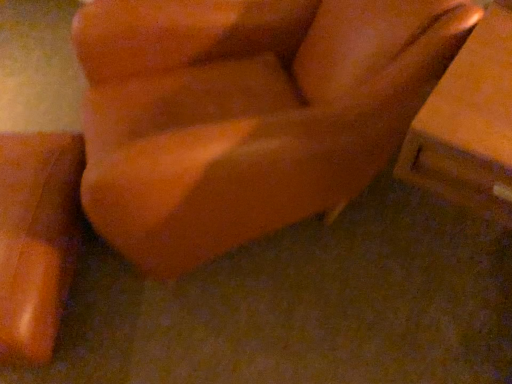
This screenshot has width=512, height=384. Identify the location of matte orange vase at lower left, which ranks as the second furniture in right-to-left order. (37, 238).

What is the approximate width of matte orange vase at lower left, which ranks as the second furniture in right-to-left order?

matte orange vase at lower left, which ranks as the second furniture in right-to-left order, is 18.40 inches in width.

The width and height of the screenshot is (512, 384). What do you see at coordinates (37, 238) in the screenshot?
I see `matte orange vase at lower left, which ranks as the second furniture in right-to-left order` at bounding box center [37, 238].

This screenshot has width=512, height=384. Describe the element at coordinates (246, 113) in the screenshot. I see `matte orange chair at center, marked as the first furniture in a right-to-left arrangement` at that location.

What is the approximate height of matte orange chair at center, marked as the first furniture in a right-to-left arrangement?

matte orange chair at center, marked as the first furniture in a right-to-left arrangement, is 30.83 inches in height.

I want to click on matte orange chair at center, marked as the first furniture in a right-to-left arrangement, so click(x=246, y=113).

At what (x,y) coordinates should I click in order to perform the action: click on matte orange vase at lower left, the first furniture in the left-to-right sequence. Please return your answer as a coordinate pair (x, y). Looking at the image, I should click on (37, 238).

Which object is positioned more to the left, matte orange chair at center, marked as the first furniture in a right-to-left arrangement, or matte orange vase at lower left, the first furniture in the left-to-right sequence?

From the viewer's perspective, matte orange vase at lower left, the first furniture in the left-to-right sequence, appears more on the left side.

Which is in front, matte orange chair at center, acting as the 2th furniture starting from the left, or matte orange vase at lower left, which ranks as the second furniture in right-to-left order?

matte orange chair at center, acting as the 2th furniture starting from the left, is in front.

Does point (198, 36) appear closer or farther from the camera than point (58, 210)?

Clearly, point (198, 36) is more distant from the camera than point (58, 210).

From the image's perspective, is matte orange chair at center, acting as the 2th furniture starting from the left, beneath matte orange vase at lower left, the first furniture in the left-to-right sequence?

No, from the image's perspective, matte orange chair at center, acting as the 2th furniture starting from the left, is not below matte orange vase at lower left, the first furniture in the left-to-right sequence.

From a real-world perspective, is matte orange chair at center, marked as the first furniture in a right-to-left arrangement, physically located above or below matte orange vase at lower left, which ranks as the second furniture in right-to-left order?

matte orange chair at center, marked as the first furniture in a right-to-left arrangement, is above matte orange vase at lower left, which ranks as the second furniture in right-to-left order.

Considering the relative sizes of matte orange chair at center, acting as the 2th furniture starting from the left, and matte orange vase at lower left, the first furniture in the left-to-right sequence, in the image provided, is matte orange chair at center, acting as the 2th furniture starting from the left, thinner than matte orange vase at lower left, the first furniture in the left-to-right sequence,?

In fact, matte orange chair at center, acting as the 2th furniture starting from the left, might be wider than matte orange vase at lower left, the first furniture in the left-to-right sequence.

Which of these two, matte orange chair at center, marked as the first furniture in a right-to-left arrangement, or matte orange vase at lower left, which ranks as the second furniture in right-to-left order, stands shorter?

matte orange vase at lower left, which ranks as the second furniture in right-to-left order.

Between matte orange chair at center, acting as the 2th furniture starting from the left, and matte orange vase at lower left, which ranks as the second furniture in right-to-left order, which one has larger size?

Bigger between the two is matte orange chair at center, acting as the 2th furniture starting from the left.

Can we say matte orange chair at center, marked as the first furniture in a right-to-left arrangement, lies outside matte orange vase at lower left, the first furniture in the left-to-right sequence?

Indeed, matte orange chair at center, marked as the first furniture in a right-to-left arrangement, is completely outside matte orange vase at lower left, the first furniture in the left-to-right sequence.

Is matte orange chair at center, acting as the 2th furniture starting from the left, positioned far away from matte orange vase at lower left, which ranks as the second furniture in right-to-left order?

No, matte orange chair at center, acting as the 2th furniture starting from the left, is not far away from matte orange vase at lower left, which ranks as the second furniture in right-to-left order.

Is matte orange chair at center, acting as the 2th furniture starting from the left, turned away from matte orange vase at lower left, the first furniture in the left-to-right sequence?

That's not correct — matte orange chair at center, acting as the 2th furniture starting from the left, is not looking away from matte orange vase at lower left, the first furniture in the left-to-right sequence.

How many degrees apart are the facing directions of matte orange chair at center, acting as the 2th furniture starting from the left, and matte orange vase at lower left, which ranks as the second furniture in right-to-left order?

The angular difference between matte orange chair at center, acting as the 2th furniture starting from the left, and matte orange vase at lower left, which ranks as the second furniture in right-to-left order, is 16.7 degrees.

Where is `furniture located in front of the matte orange vase at lower left, the first furniture in the left-to-right sequence`? furniture located in front of the matte orange vase at lower left, the first furniture in the left-to-right sequence is located at coordinates (246, 113).

Is matte orange vase at lower left, the first furniture in the left-to-right sequence, at the right side of matte orange chair at center, marked as the first furniture in a right-to-left arrangement?

No, matte orange vase at lower left, the first furniture in the left-to-right sequence, is not to the right of matte orange chair at center, marked as the first furniture in a right-to-left arrangement.

Who is more distant, matte orange vase at lower left, the first furniture in the left-to-right sequence, or matte orange chair at center, marked as the first furniture in a right-to-left arrangement?

matte orange vase at lower left, the first furniture in the left-to-right sequence.

Which is closer, (61, 275) or (206, 159)?

The point (206, 159) is more forward.

From the image's perspective, between matte orange vase at lower left, which ranks as the second furniture in right-to-left order, and matte orange chair at center, acting as the 2th furniture starting from the left, who is located below?

matte orange vase at lower left, which ranks as the second furniture in right-to-left order, from the image's perspective.

From the picture: From a real-world perspective, is matte orange vase at lower left, which ranks as the second furniture in right-to-left order, positioned over matte orange chair at center, marked as the first furniture in a right-to-left arrangement, based on gravity?

No, from a real-world perspective, matte orange vase at lower left, which ranks as the second furniture in right-to-left order, is not over matte orange chair at center, marked as the first furniture in a right-to-left arrangement

Is matte orange vase at lower left, the first furniture in the left-to-right sequence, wider or thinner than matte orange chair at center, acting as the 2th furniture starting from the left?

Considering their sizes, matte orange vase at lower left, the first furniture in the left-to-right sequence, looks slimmer than matte orange chair at center, acting as the 2th furniture starting from the left.

Based on the photo, does matte orange vase at lower left, which ranks as the second furniture in right-to-left order, have a lesser height compared to matte orange chair at center, marked as the first furniture in a right-to-left arrangement?

Correct, matte orange vase at lower left, which ranks as the second furniture in right-to-left order, is not as tall as matte orange chair at center, marked as the first furniture in a right-to-left arrangement.

Between matte orange vase at lower left, which ranks as the second furniture in right-to-left order, and matte orange chair at center, acting as the 2th furniture starting from the left, which one has smaller size?

matte orange vase at lower left, which ranks as the second furniture in right-to-left order, is smaller.

Would you say matte orange vase at lower left, the first furniture in the left-to-right sequence, contains matte orange chair at center, acting as the 2th furniture starting from the left?

Definitely not — matte orange chair at center, acting as the 2th furniture starting from the left, is not inside matte orange vase at lower left, the first furniture in the left-to-right sequence.

Would you say matte orange vase at lower left, which ranks as the second furniture in right-to-left order, is a long distance from matte orange chair at center, marked as the first furniture in a right-to-left arrangement?

No, there isn't a large distance between matte orange vase at lower left, which ranks as the second furniture in right-to-left order, and matte orange chair at center, marked as the first furniture in a right-to-left arrangement.

Could you tell me if matte orange vase at lower left, which ranks as the second furniture in right-to-left order, is facing matte orange chair at center, marked as the first furniture in a right-to-left arrangement?

No, matte orange vase at lower left, which ranks as the second furniture in right-to-left order, is not turned towards matte orange chair at center, marked as the first furniture in a right-to-left arrangement.

Locate an element on the screen. The width and height of the screenshot is (512, 384). furniture in front of the matte orange vase at lower left, the first furniture in the left-to-right sequence is located at coordinates (246, 113).

This screenshot has height=384, width=512. Identify the location of furniture lying on the left of matte orange chair at center, marked as the first furniture in a right-to-left arrangement. click(37, 238).

Where is `furniture that is above the matte orange vase at lower left, which ranks as the second furniture in right-to-left order (from a real-world perspective)`? This screenshot has width=512, height=384. furniture that is above the matte orange vase at lower left, which ranks as the second furniture in right-to-left order (from a real-world perspective) is located at coordinates (246, 113).